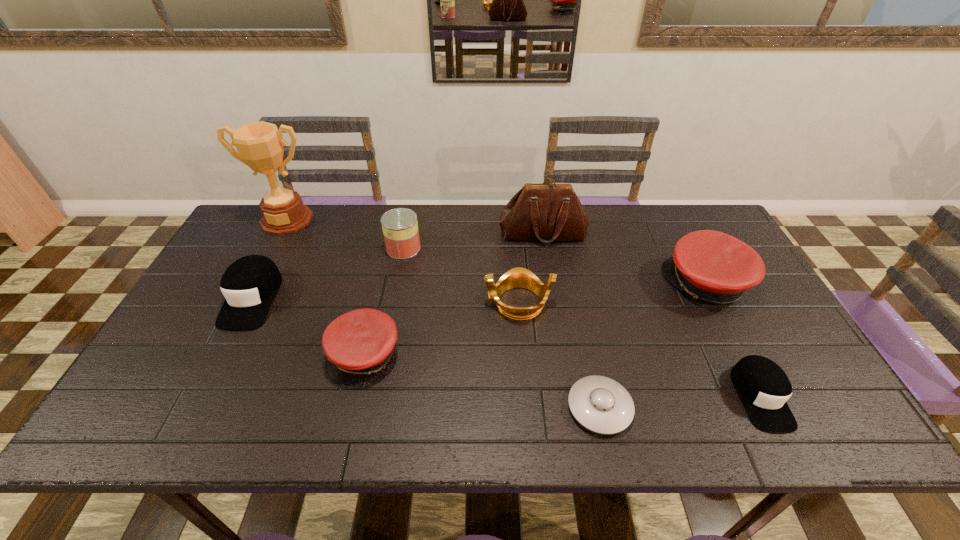
Locate an element on the screen. The width and height of the screenshot is (960, 540). saucer at the near edge is located at coordinates (600, 404).

You are a GUI agent. You are given a task and a screenshot of the screen. Output one action in this format:
    pyautogui.click(x=<x>, y=<y>)
    Task: Click on the award located in the left edge section of the desktop
    
    Given the screenshot: What is the action you would take?
    pyautogui.click(x=259, y=144)

Where is `cap situated at the left edge`? The height and width of the screenshot is (540, 960). cap situated at the left edge is located at coordinates (249, 285).

I want to click on object present at the far left corner, so click(259, 144).

Where is `object located at the near right corner`? object located at the near right corner is located at coordinates (763, 386).

Locate an element on the screen. The image size is (960, 540). vacant space at the far edge of the desktop is located at coordinates (445, 222).

Identify the location of vacant region at the near edge of the desktop. (318, 414).

Locate an element on the screen. This screenshot has height=540, width=960. vacant space at the far right corner of the desktop is located at coordinates (698, 228).

Where is `free spot between the award and the right red cap`? The height and width of the screenshot is (540, 960). free spot between the award and the right red cap is located at coordinates (496, 252).

At what (x,y) coordinates should I click in order to perform the action: click on vacant space that is in between the second tallest object and the farther red cap. Please return your answer as a coordinate pair (x, y). This screenshot has height=540, width=960. Looking at the image, I should click on (625, 259).